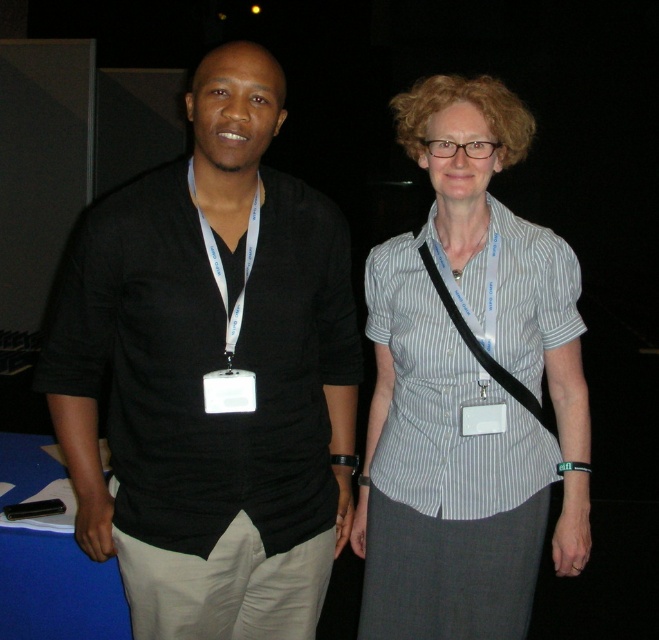
Question: Does black cotton shirt at left have a smaller size compared to white striped shirt at center?

Choices:
 (A) no
 (B) yes

Answer: (B)

Question: Among these objects, which one is farthest from the camera?

Choices:
 (A) black cotton shirt at left
 (B) white striped shirt at center

Answer: (B)

Question: Is black cotton shirt at left behind white striped shirt at center?

Choices:
 (A) no
 (B) yes

Answer: (A)

Question: Can you confirm if black cotton shirt at left is smaller than white striped shirt at center?

Choices:
 (A) no
 (B) yes

Answer: (B)

Question: Which of the following is the farthest from the observer?

Choices:
 (A) (154, 536)
 (B) (474, 516)

Answer: (B)